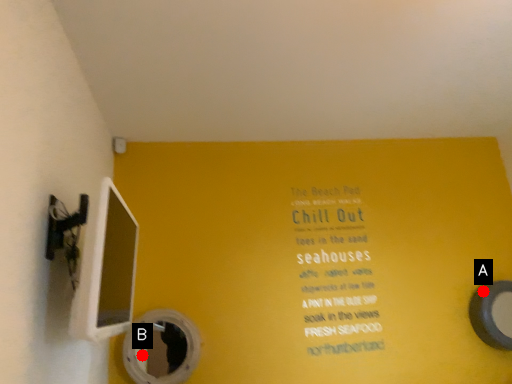
Question: Two points are circled on the image, labeled by A and B beside each circle. Which point appears closest to the camera in this image?

Choices:
 (A) A is closer
 (B) B is closer

Answer: (B)